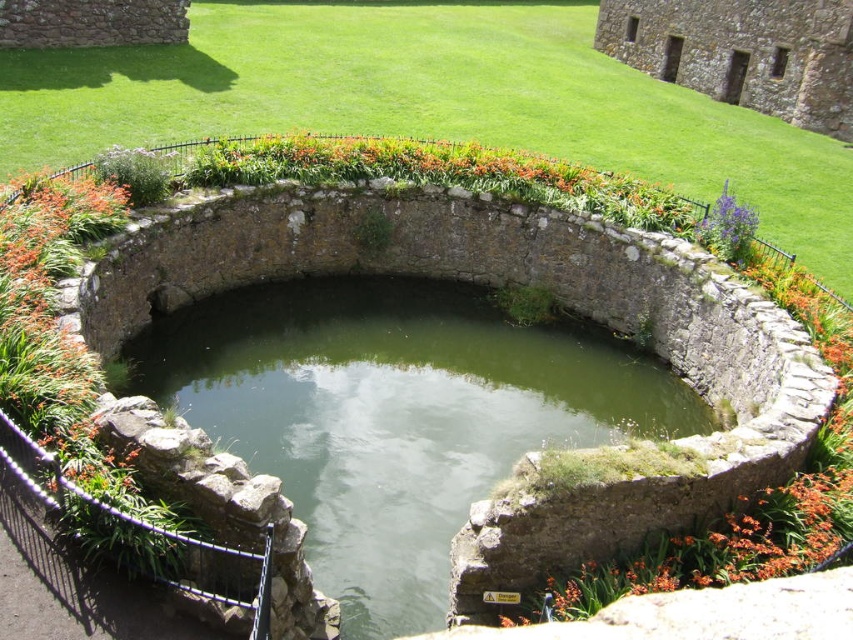
Does green stone water at center lie behind purple matte flower at upper right?

No, it is in front of purple matte flower at upper right.

You are a GUI agent. You are given a task and a screenshot of the screen. Output one action in this format:
    pyautogui.click(x=<x>, y=<y>)
    Task: Click on the green stone water at center
    The image size is (853, 640).
    Given the screenshot: What is the action you would take?
    pyautogui.click(x=393, y=413)

Describe the element at coordinates (393, 413) in the screenshot. I see `green stone water at center` at that location.

The image size is (853, 640). I want to click on green stone water at center, so click(393, 413).